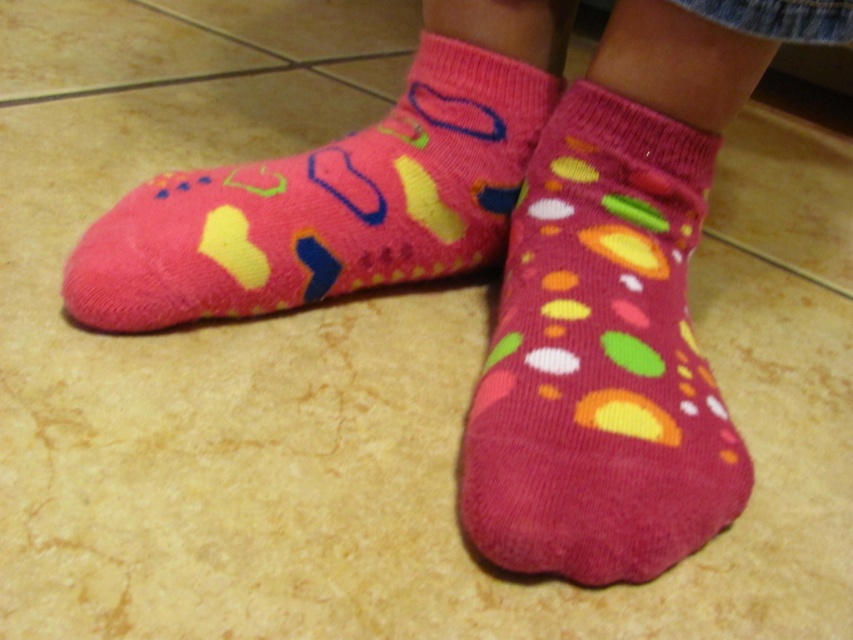
You are trying to pack your travel bag and have two pairs of socks in front of you. You need to know which pair takes up more room. Which pair of socks occupies more space between the pink soft socks at center and the pink fuzzy socks at left?

The pink fuzzy socks at left occupies more space than the pink soft socks at center.

You are trying to decide which pair of socks to wear today. You see the pink soft socks at center and the pink fuzzy socks at left. Which one is located to the right of the other?

The pink soft socks at center is positioned on the right side of pink fuzzy socks at left.

You are trying to decide which pair of pink socks to put on first. You see the pink soft socks at center and the pink fuzzy socks at left. Which pair is closer to you?

The pink soft socks at center is closer to the viewer than the pink fuzzy socks at left, so you should reach for the pink soft socks at center first.